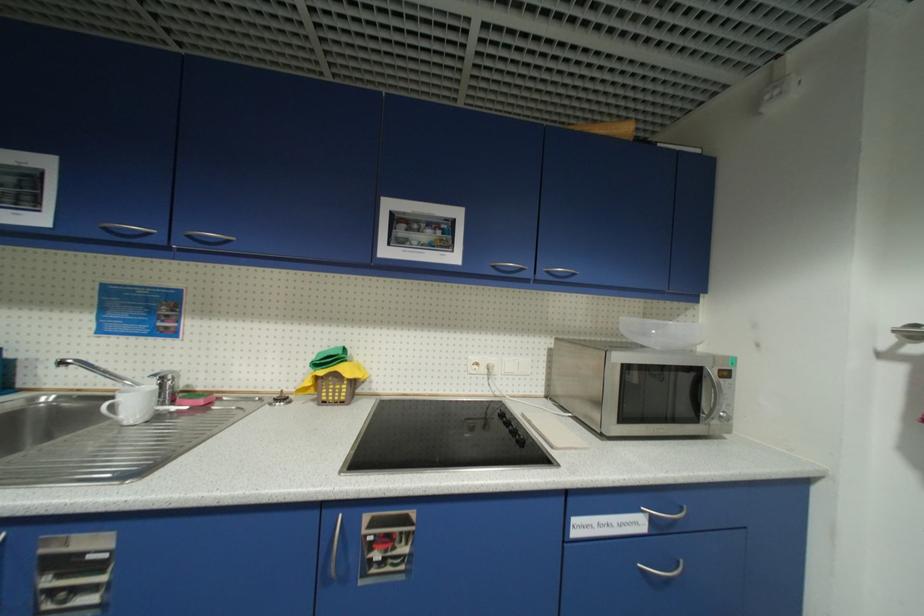
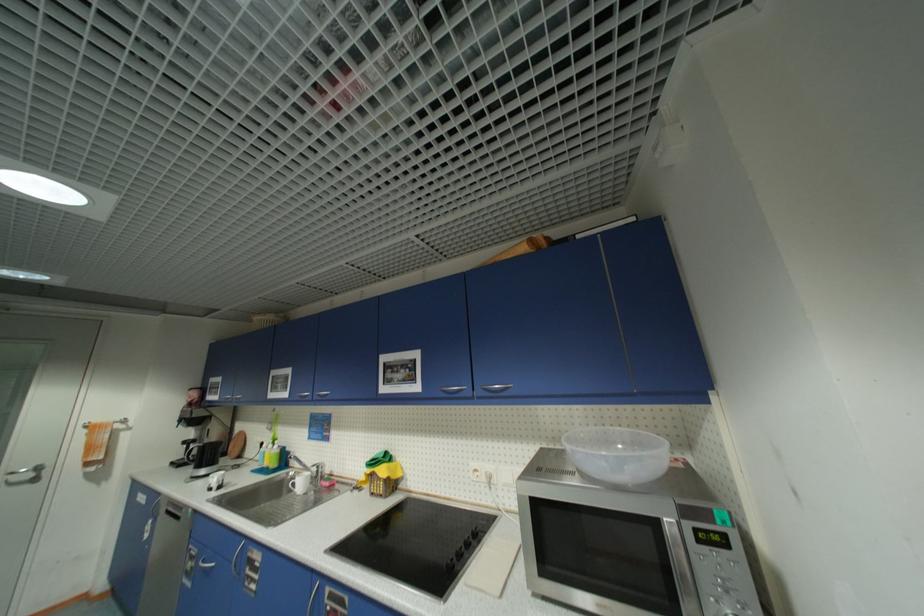
The point at [196,238] is marked in the first image. Where is the corresponding point in the second image?

(323, 395)